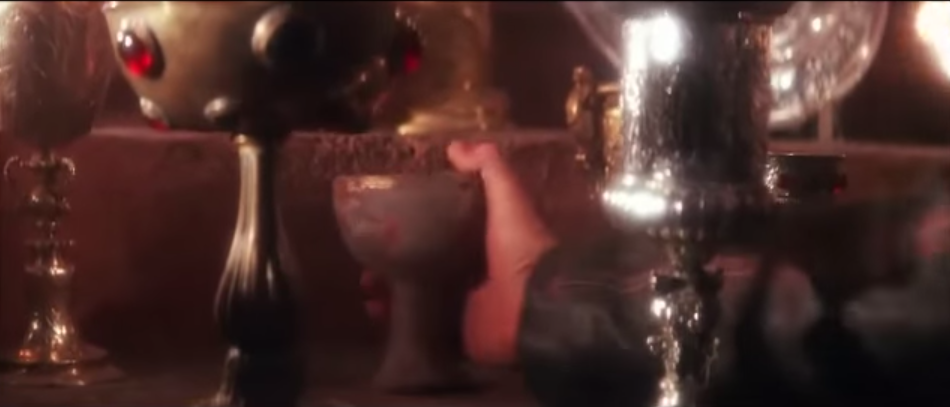
Locate an element on the screen. The image size is (950, 407). goblets is located at coordinates (211, 46), (3, 94), (424, 213), (728, 96), (593, 108), (815, 166).